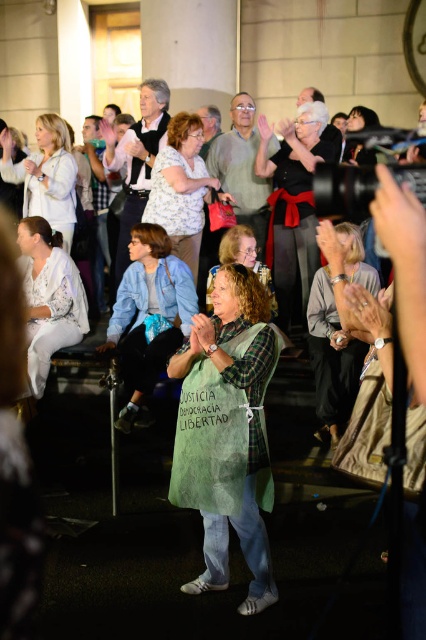
You are a photographer trying to capture the best shot of the two points in the scene. Which point, point (x=365, y=269) or point (x=270, y=141), would appear larger in your photo?

Point (x=365, y=269) is closer to the viewer than point (x=270, y=141), so it would appear larger in the photo.

You are a photographer trying to capture the woman in the scene. You notice the gray fabric scarf at center and the matte green shirt at center. Which item will appear smaller in your photo?

The gray fabric scarf at center will appear smaller in the photo because it has a lesser height compared to the matte green shirt at center.

You are standing in the crowd at the event and want to take a photo of the point at coordinates point (213, 346). Your camera has a focal length of 50mm and a sensor size of 24mm. What is the minimum distance you need to be from the point to ensure the entire scene fits in the frame?

The point (213, 346) is 3.16 meters from the viewer. To calculate the minimum distance required, use the formula distance > focal length multiplied by sensor size divided by subject size. However, without knowing the subject size, we cannot determine the exact distance. Ensure you are at least 3.16 meters away to capture the point within the frame.